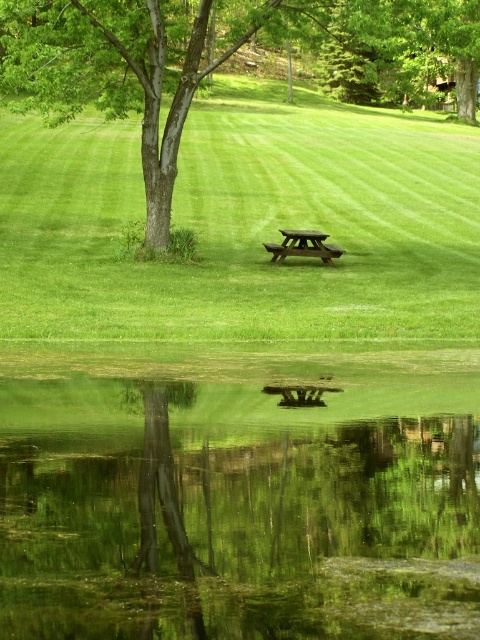
Does point (82, 13) come farther from viewer compared to point (308, 250)?

No, (82, 13) is closer to viewer.

Does green leafy tree at center appear under brown wooden picnic table at center?

No.

Does point (78, 76) lie behind point (287, 252)?

Yes, it is behind point (287, 252).

The image size is (480, 640). Identify the location of green leafy tree at center. (132, 67).

Which is below, brown wooden picnic table at center or brown wooden bench at center?

brown wooden bench at center is below.

Who is more forward, (289, 252) or (342, 252)?

Point (342, 252) is more forward.

At what (x,y) coordinates should I click in order to perform the action: click on brown wooden picnic table at center. Please return your answer as a coordinate pair (x, y). Looking at the image, I should click on (303, 244).

Where is `green leafy tree at center`? This screenshot has width=480, height=640. green leafy tree at center is located at coordinates (132, 67).

Who is shorter, green leafy tree at center or green leafy tree at upper center?

Standing shorter between the two is green leafy tree at upper center.

Identify the location of green leafy tree at center. (132, 67).

This screenshot has height=640, width=480. Find the location of `green leafy tree at center`. green leafy tree at center is located at coordinates (132, 67).